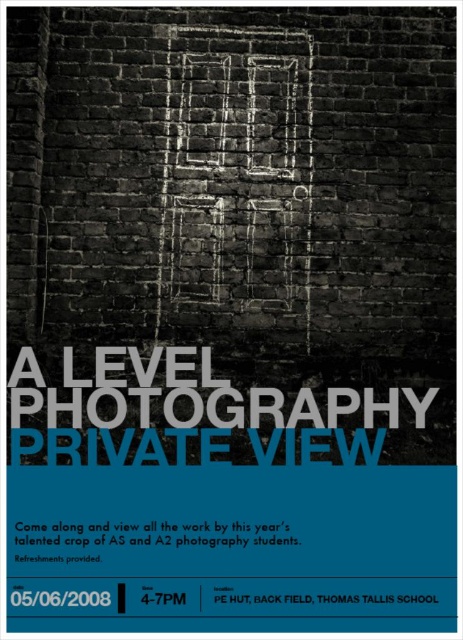
You are an event planner arranging materials for the A Level Photography Private View poster. You have a white paper at center and a black paper at lower center. According to the poster design, which paper is placed to the right of the other?

The white paper at center is positioned on the right side of black paper at lower center.

You are designing a layout for a poster and have two papers available. The white paper at center and the black paper at lower center. Which paper has a greater width?

The white paper at center has a greater width than the black paper at lower center.

You are an event planner setting up for the A Level Photography Private View. You need to place a decorative item on the white paper at center. However, there is a black paper at lower center in the scene. Which paper should you place the item on to ensure it is visible from the front of the room?

You should place the decorative item on the white paper at center because the black paper at lower center is behind it. Since the white paper is in front, the item will be more visible from the front of the room.